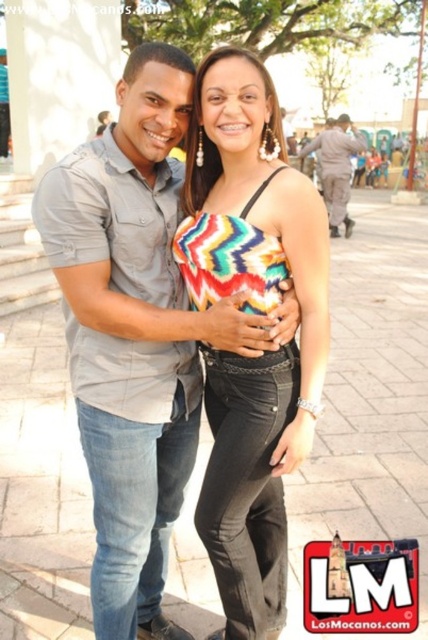
What do you see at coordinates (255, 312) in the screenshot? Image resolution: width=428 pixels, height=640 pixels. I see `multicolored zigzag top at center` at bounding box center [255, 312].

Identify the location of multicolored zigzag top at center. (255, 312).

Measure the distance between multicolored zigzag top at center and camera.

A distance of 1.89 meters exists between multicolored zigzag top at center and camera.

At what (x,y) coordinates should I click in order to perform the action: click on multicolored zigzag top at center. Please return your answer as a coordinate pair (x, y). Image resolution: width=428 pixels, height=640 pixels. Looking at the image, I should click on (255, 312).